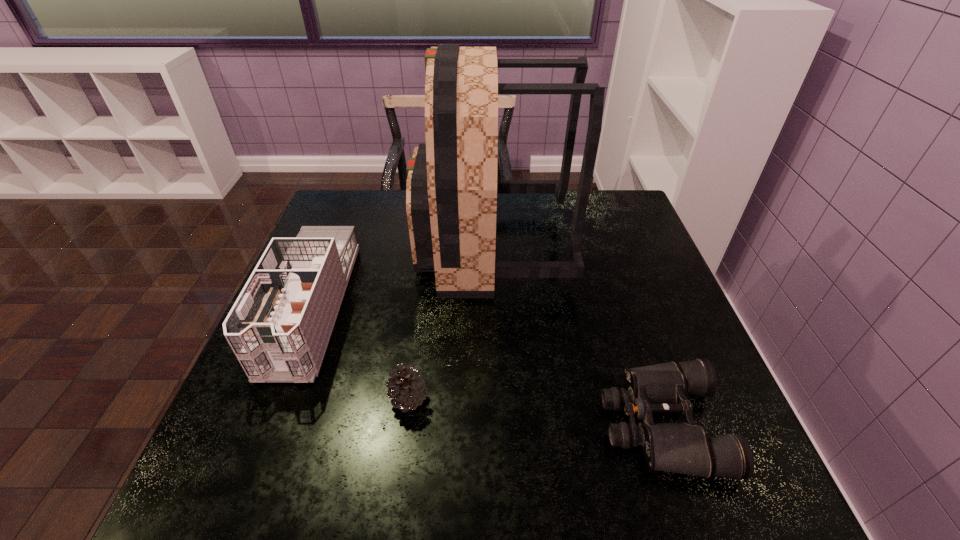
Where is `free location located through the eyepieces of the shortest object`? free location located through the eyepieces of the shortest object is located at coordinates (449, 425).

Image resolution: width=960 pixels, height=540 pixels. In order to click on vacant space positioned through the eyepieces of the shortest object in this screenshot , I will do [465, 425].

Locate an element on the screen. The image size is (960, 540). free space located 0.250m through the eyepieces of the shortest object is located at coordinates (470, 425).

Locate an element on the screen. object that is at the far edge is located at coordinates [x=451, y=190].

Locate an element on the screen. This screenshot has width=960, height=540. object located in the near edge section of the desktop is located at coordinates (685, 448).

Where is `object positioned at the left edge`? The height and width of the screenshot is (540, 960). object positioned at the left edge is located at coordinates (279, 327).

Where is `object at the right edge`? The width and height of the screenshot is (960, 540). object at the right edge is located at coordinates (685, 448).

What are the coordinates of `object that is at the near right corner` in the screenshot? It's located at (685, 448).

Locate an element on the screen. vacant area at the near edge of the desktop is located at coordinates (413, 503).

In the image, there is a desktop. Where is `free space at the left edge`? The width and height of the screenshot is (960, 540). free space at the left edge is located at coordinates (357, 270).